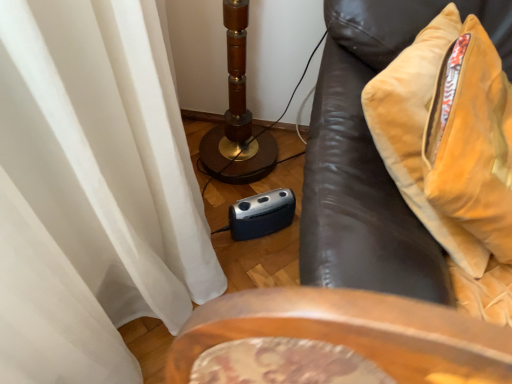
Question: Is velvet brown sofa at right spatially inside velvet yellow pillow at right, or outside of it?

Choices:
 (A) outside
 (B) inside

Answer: (A)

Question: Would you say velvet brown sofa at right is to the left or to the right of velvet yellow pillow at right in the picture?

Choices:
 (A) right
 (B) left

Answer: (A)

Question: Looking at their shapes, would you say velvet brown sofa at right is wider or thinner than velvet yellow pillow at right?

Choices:
 (A) thin
 (B) wide

Answer: (B)

Question: From a real-world perspective, relative to velvet brown sofa at right, is velvet yellow pillow at right vertically above or below?

Choices:
 (A) below
 (B) above

Answer: (B)

Question: Choose the correct answer: Is velvet yellow pillow at right inside velvet brown sofa at right or outside it?

Choices:
 (A) outside
 (B) inside

Answer: (B)

Question: Is velvet yellow pillow at right wider or thinner than velvet brown sofa at right?

Choices:
 (A) thin
 (B) wide

Answer: (A)

Question: From their relative heights in the image, would you say velvet yellow pillow at right is taller or shorter than velvet brown sofa at right?

Choices:
 (A) short
 (B) tall

Answer: (A)